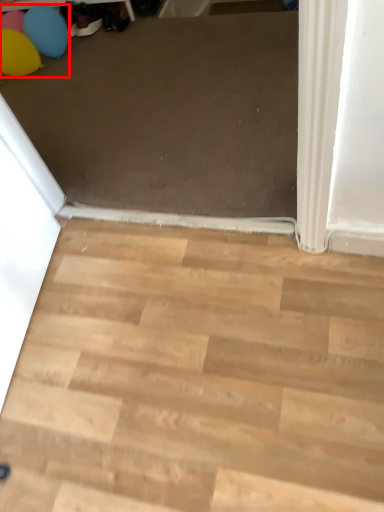
Question: From the image's perspective, where is balloon (annotated by the red box) located relative to stairwell?

Choices:
 (A) above
 (B) below

Answer: (A)